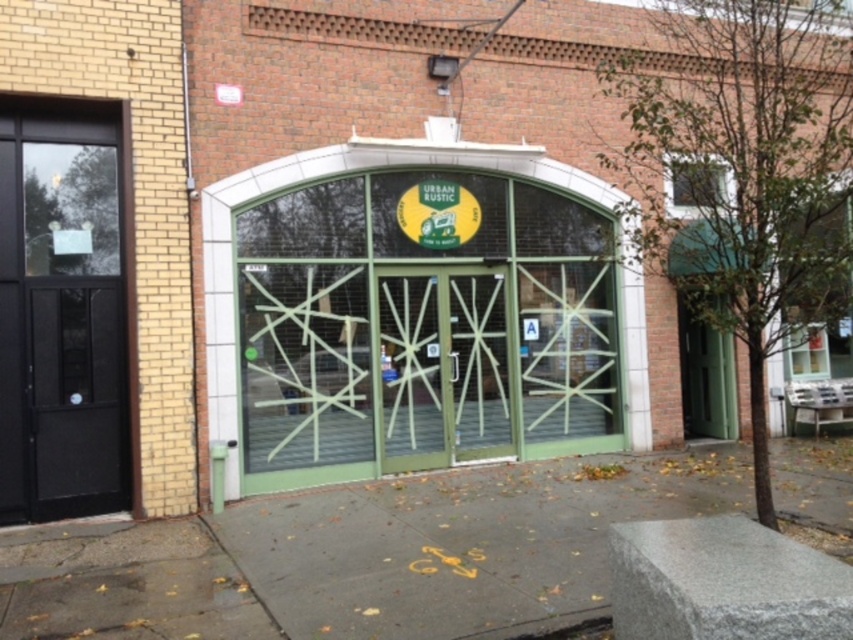
Question: Which is farther from the green matte door at right?

Choices:
 (A) green matte door at center
 (B) black glass door at left
 (C) green matte glass door at center
 (D) gray concrete sidewalk at center

Answer: (D)

Question: Which point is closer to the camera?

Choices:
 (A) (102, 180)
 (B) (27, 552)
 (C) (376, 225)
 (D) (712, 385)

Answer: (B)

Question: Can you confirm if green matte glass door at center is positioned above green matte door at center?

Choices:
 (A) yes
 (B) no

Answer: (A)

Question: Which of the following is the farthest from the observer?

Choices:
 (A) (689, 352)
 (B) (16, 196)

Answer: (A)

Question: Is green matte glass door at center wider than green matte door at right?

Choices:
 (A) yes
 (B) no

Answer: (A)

Question: Does black glass door at left have a smaller size compared to green matte door at right?

Choices:
 (A) no
 (B) yes

Answer: (A)